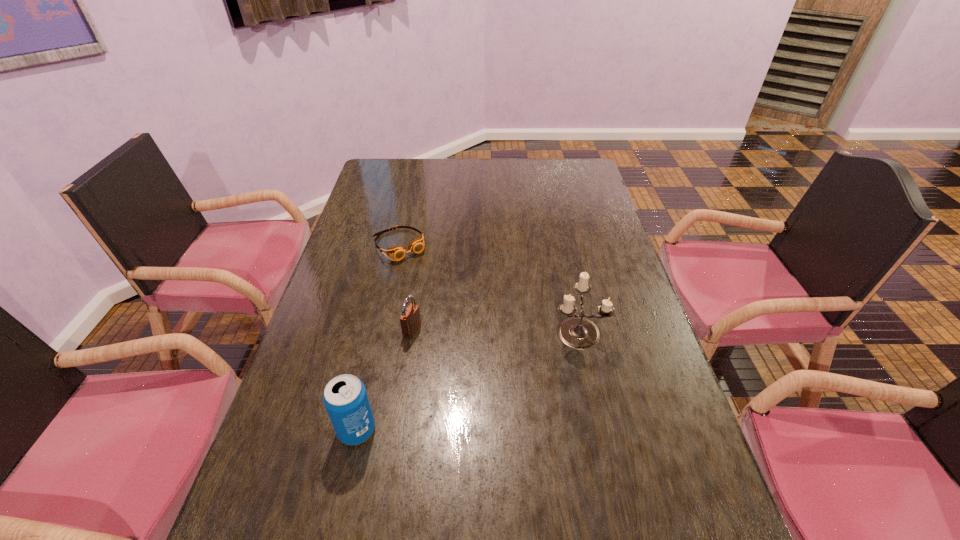
Find the location of a particular element. The width and height of the screenshot is (960, 540). vacant space on the desktop that is between the nearest object and the rightmost object and is positioned on the front-facing side of the second shortest object is located at coordinates (508, 361).

Locate an element on the screen. This screenshot has height=540, width=960. free spot on the desktop that is between the soda can and the candle holder and is positioned with the lenses facing forward on the goggles is located at coordinates click(494, 368).